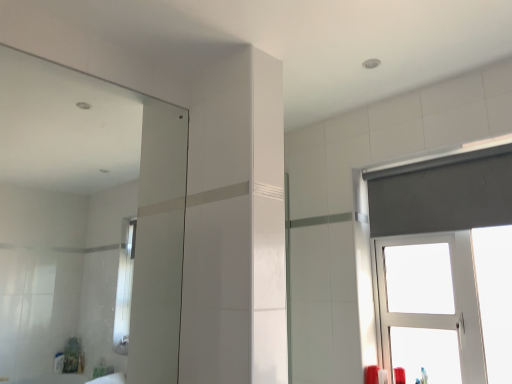
Question: Considering their positions, is white plastic window at upper right located in front of or behind matte plastic toothbrush at lower right, the first toiletry in the left-to-right sequence?

Choices:
 (A) front
 (B) behind

Answer: (A)

Question: Considering the relative positions of white plastic window at upper right and matte plastic toothbrush at lower right, the 2th toiletry viewed from the right, in the image provided, is white plastic window at upper right to the left or to the right of matte plastic toothbrush at lower right, the 2th toiletry viewed from the right,?

Choices:
 (A) left
 (B) right

Answer: (B)

Question: Considering the real-world distances, which object is farthest from the matte red candle at lower right, acting as the 2th toiletry starting from the left?

Choices:
 (A) matte plastic toothbrush at lower right, the 2th toiletry viewed from the right
 (B) white plastic window at upper right
 (C) clear glass mirror at upper left

Answer: (C)

Question: Based on their relative distances, which object is nearer to the clear glass mirror at upper left?

Choices:
 (A) matte red candle at lower right, acting as the 2th toiletry starting from the left
 (B) matte plastic toothbrush at lower right, the 2th toiletry viewed from the right
 (C) white plastic window at upper right

Answer: (C)